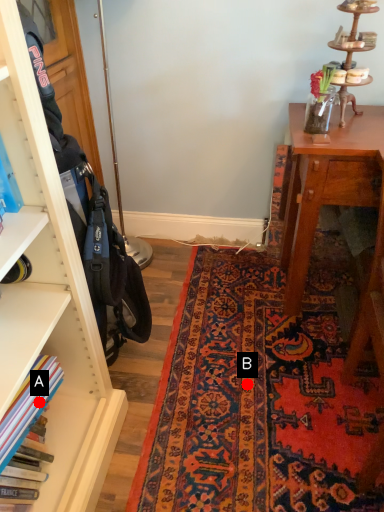
Question: Two points are circled on the image, labeled by A and B beside each circle. Which point is closer to the camera?

Choices:
 (A) A is closer
 (B) B is closer

Answer: (A)